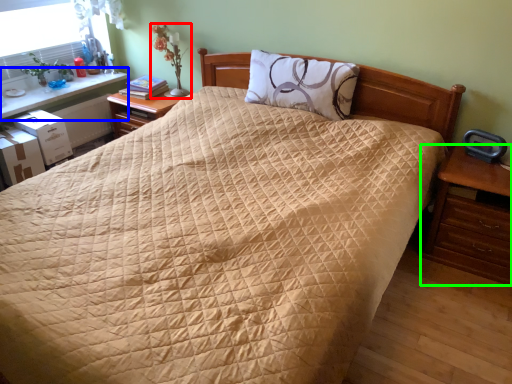
Question: Based on their relative distances, which object is nearer to table lamp (highlighted by a red box)? Choose from table (highlighted by a blue box) and nightstand (highlighted by a green box).

Choices:
 (A) table
 (B) nightstand

Answer: (A)